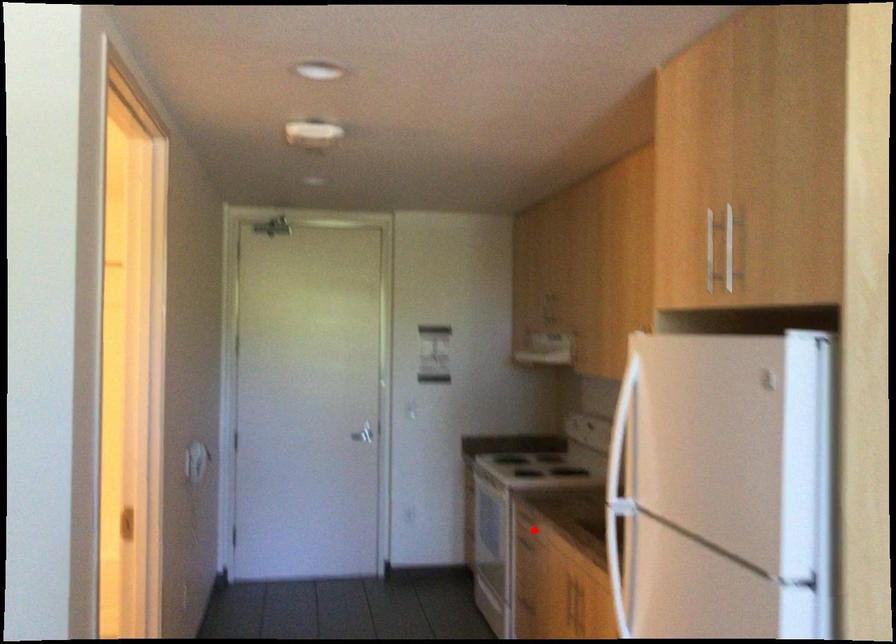
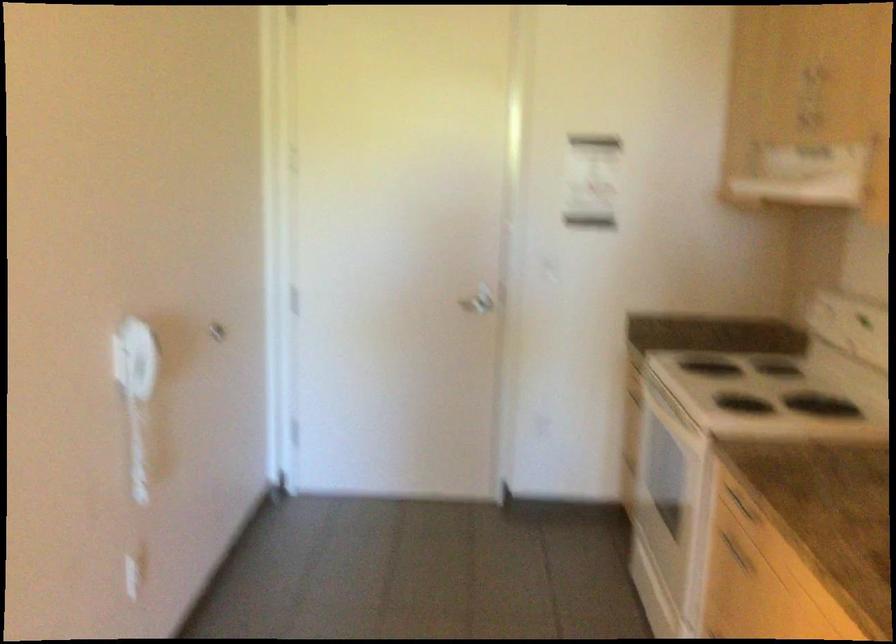
Locate, in the second image, the point that corresponds to the highlighted location in the first image.

(735, 552)